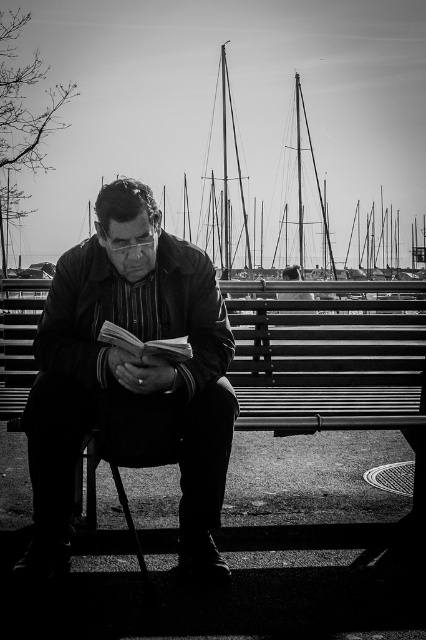
You are a photographer taking a picture of the scene described. You want to ensure that both the matte black jacket at center and the thick paper book at center are clearly visible in your photo. Given their relative sizes, which object should you focus on to ensure both are in focus without adjusting the camera settings?

The matte black jacket at center is taller than the thick paper book at center. Since the jacket is taller, focusing on it would ensure both objects are in focus as the book is smaller and within the same plane.

You are standing at point (100, 339) and want to walk towards point (120, 225). Based on the scene description, will you be moving forward or backward relative to your current position?

Since point (120, 225) is behind point (100, 339), moving towards it would mean you are moving backward relative to your current position.

You are a tailor measuring items for a display. You have a shelf that can only accommodate items up to the width of the thick paper book at center. Can the matte black jacket at center fit on this shelf?

The matte black jacket at center is wider than the thick paper book at center, so it cannot fit on the shelf designed for items up to the book width.